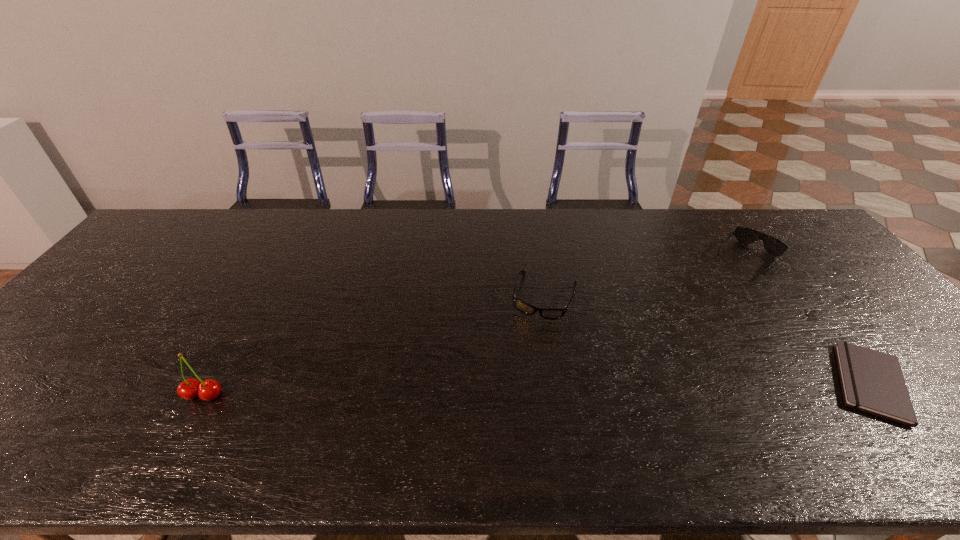
Where is `free space on the desktop that is between the leftmost object and the shortest object and is positioned on the front-facing side of the sunglasses`? free space on the desktop that is between the leftmost object and the shortest object and is positioned on the front-facing side of the sunglasses is located at coordinates (636, 387).

Locate an element on the screen. The image size is (960, 540). vacant spot on the desktop that is between the leftmost object and the checkbook and is positioned on the front-facing side of the third object from right to left is located at coordinates (516, 389).